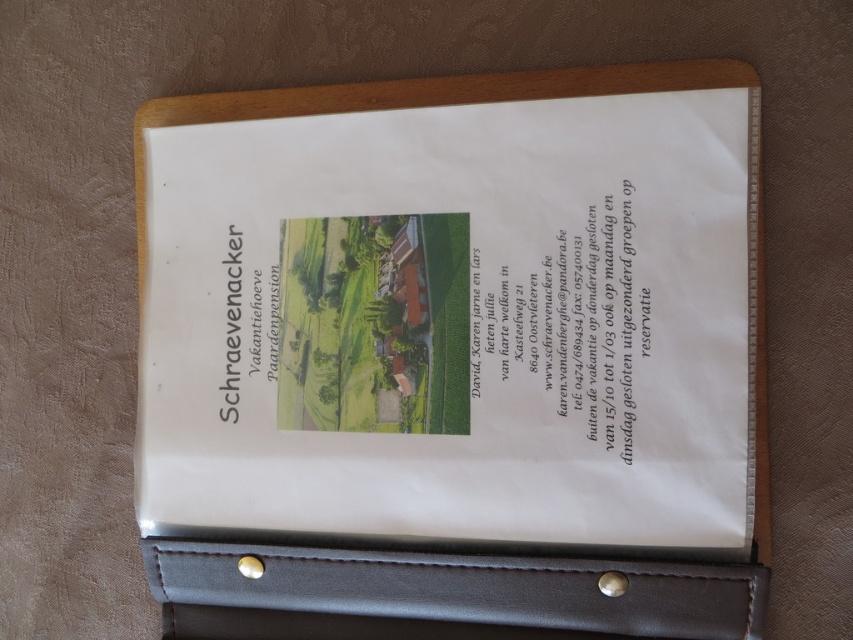
Is white paper at center to the left of black leather pocket at bottom from the viewer's perspective?

No, white paper at center is not to the left of black leather pocket at bottom.

Between point (639, 148) and point (387, 588), which one is positioned in front?

Point (639, 148) is in front.

The height and width of the screenshot is (640, 853). I want to click on white paper at center, so click(457, 349).

At what (x,y) coordinates should I click in order to perform the action: click on white paper at center. Please return your answer as a coordinate pair (x, y). This screenshot has width=853, height=640. Looking at the image, I should click on coord(457,349).